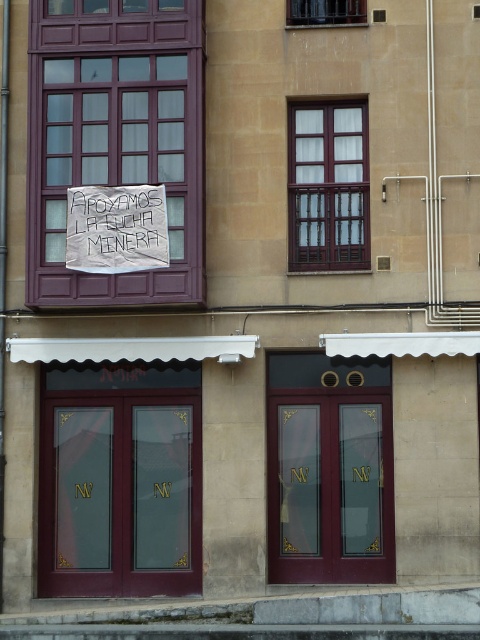
Question: Which point appears closest to the camera in this image?

Choices:
 (A) (328, 8)
 (B) (324, 413)
 (C) (111, 68)
 (D) (169, 557)

Answer: (D)

Question: Which point is farther to the camera?

Choices:
 (A) burgundy glass doors at center
 (B) wooden window at center
 (C) clear glass window at upper center

Answer: (C)

Question: Can you confirm if burgundy glass doors at center is thinner than wooden window at center?

Choices:
 (A) no
 (B) yes

Answer: (A)

Question: In this image, where is burgundy glass doors at center located relative to clear glass window at upper center?

Choices:
 (A) below
 (B) above

Answer: (A)

Question: Can you confirm if wooden window at center is positioned below clear glass window at upper center?

Choices:
 (A) yes
 (B) no

Answer: (A)

Question: Which of the following is the farthest from the observer?

Choices:
 (A) (172, 300)
 (B) (340, 148)

Answer: (B)